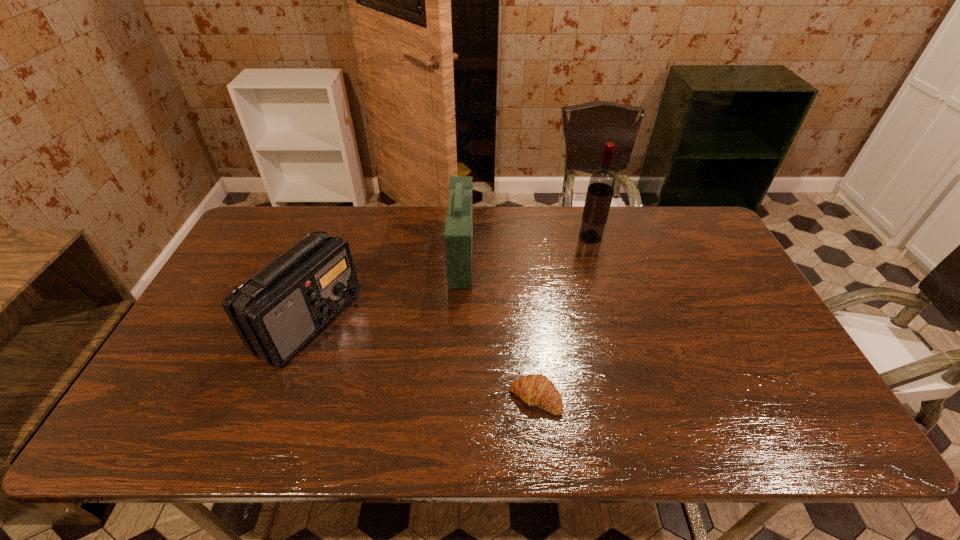
Locate an element on the screen. empty space that is in between the nearest object and the first-aid kit is located at coordinates (498, 327).

At what (x,y) coordinates should I click in order to perform the action: click on free space between the wine bottle and the third object from right to left. Please return your answer as a coordinate pair (x, y). Looking at the image, I should click on (526, 247).

I want to click on unoccupied position between the second object from right to left and the rightmost object, so click(x=563, y=318).

The width and height of the screenshot is (960, 540). I want to click on free space between the shortest object and the rightmost object, so click(563, 318).

At what (x,y) coordinates should I click in order to perform the action: click on free space that is in between the tallest object and the shortest object. Please return your answer as a coordinate pair (x, y). The width and height of the screenshot is (960, 540). Looking at the image, I should click on (563, 318).

Where is `the closest object to the third object from right to left`? The width and height of the screenshot is (960, 540). the closest object to the third object from right to left is located at coordinates (277, 311).

Choose which object is the nearest neighbor to the rightmost object. Please provide its 2D coordinates. Your answer should be formatted as a tuple, i.e. [(x, y)], where the tuple contains the x and y coordinates of a point satisfying the conditions above.

[(458, 235)]

Where is `vacant area that satisfies the following two spatial constraints: 1. on the front-facing side of the first-aid kit; 2. on the left side of the third object from left to right`? This screenshot has height=540, width=960. vacant area that satisfies the following two spatial constraints: 1. on the front-facing side of the first-aid kit; 2. on the left side of the third object from left to right is located at coordinates (455, 398).

The width and height of the screenshot is (960, 540). Find the location of `free space that satisfies the following two spatial constraints: 1. on the back side of the crescent roll; 2. on the front-facing side of the second object from left to right`. free space that satisfies the following two spatial constraints: 1. on the back side of the crescent roll; 2. on the front-facing side of the second object from left to right is located at coordinates (521, 256).

The image size is (960, 540). I want to click on free point that satisfies the following two spatial constraints: 1. on the front-facing side of the second object from right to left; 2. on the right side of the second object from left to right, so click(x=455, y=398).